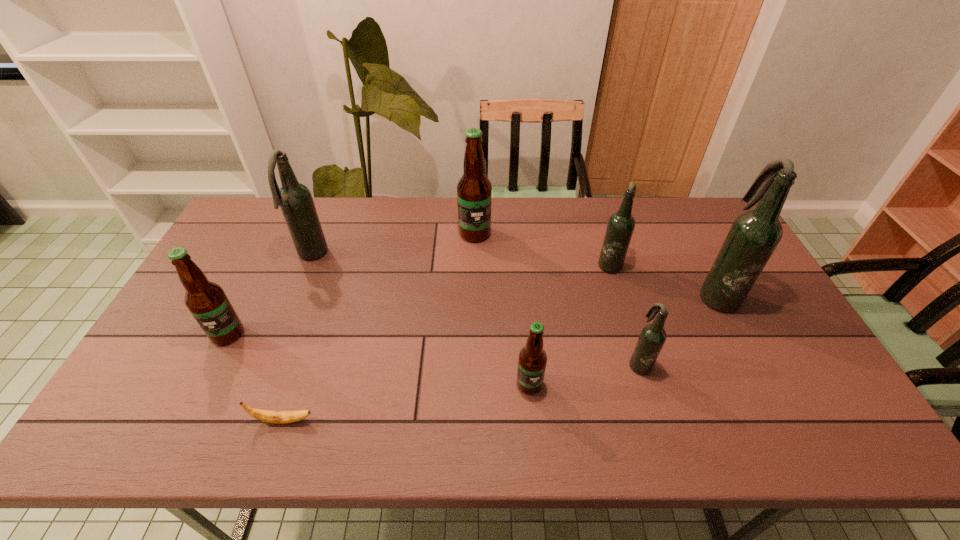
I want to click on vacant space positioned 0.110m on the label of the rightmost brown beer bottle, so click(535, 440).

In order to click on vacant space located on the peel of the shortest object from the top in this screenshot , I will do `click(469, 421)`.

I want to click on object present at the far edge, so click(x=474, y=190).

In order to click on object that is at the near edge in this screenshot , I will do `click(279, 417)`.

The image size is (960, 540). Find the location of `object located in the left edge section of the desktop`. object located in the left edge section of the desktop is located at coordinates (207, 302).

Locate an element on the screen. The image size is (960, 540). object that is at the right edge is located at coordinates (754, 235).

Locate an element on the screen. The image size is (960, 540). vacant space at the far edge is located at coordinates (354, 229).

Where is `free space at the near edge of the desktop`? The image size is (960, 540). free space at the near edge of the desktop is located at coordinates (423, 431).

The image size is (960, 540). In order to click on free space at the right edge of the desktop in this screenshot , I will do `click(707, 244)`.

I want to click on vacant area at the far right corner, so click(700, 204).